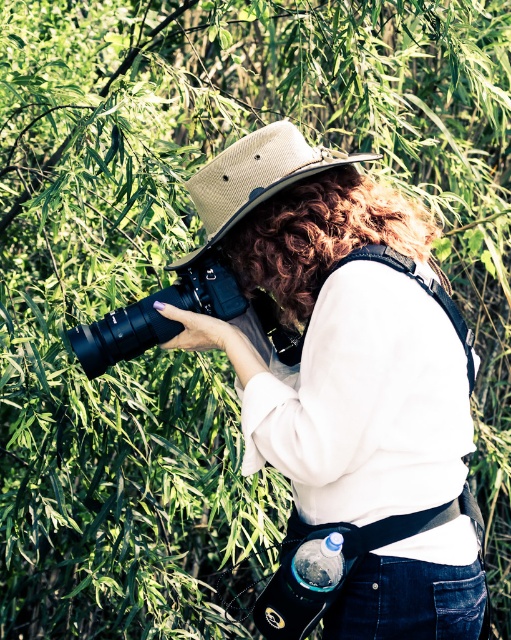
You are standing at point A and want to reach point B. You see two points, point (285, 154) and point (144, 339). Which point is closer to you?

Point (285, 154) is in front of point (144, 339), so it is closer to you.

You are a photographer who just took a picture of the beige canvas hat at center. Where did you position the hat in the frame?

The beige canvas hat at center is positioned at the 2D coordinates of point (253, 177) in the frame.

Consider the image. You are a photographer setting up for a landscape shot. You have a beige canvas hat at center and want to ensure it stays in frame. If your camera has a focal length of 50mm and you are 1.63 meters away from the hat, will the hat remain in the frame when you zoom out to 24mm?

The beige canvas hat at center is 1.63 meters from the camera. When zooming out from 50mm to 24mm, the field of view widens, so the hat will remain in the frame as the camera is positioned at the correct distance.